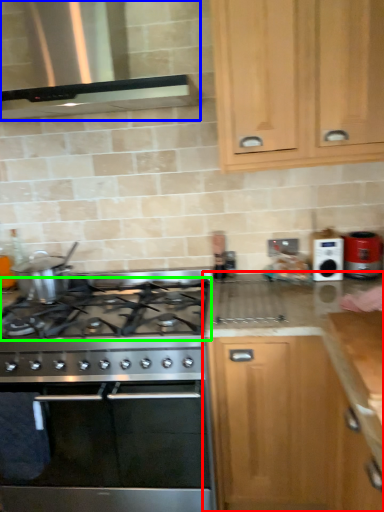
Question: Which is farther away from cabinetry (highlighted by a red box)? vent (highlighted by a blue box) or gas stove (highlighted by a green box)?

Choices:
 (A) vent
 (B) gas stove

Answer: (A)